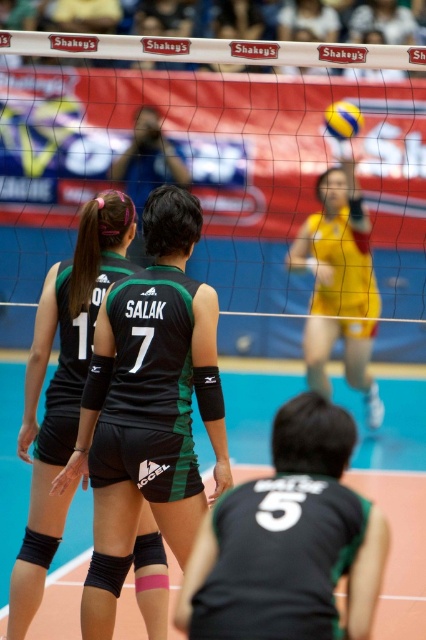
Question: Does transparent nylon net at center appear on the right side of yellow/yellowish-green jersey at center?

Choices:
 (A) yes
 (B) no

Answer: (B)

Question: Does transparent nylon net at center have a smaller size compared to black matte uniform at center?

Choices:
 (A) yes
 (B) no

Answer: (B)

Question: Is black matte uniform at center above yellow/yellowish-green jersey at center?

Choices:
 (A) no
 (B) yes

Answer: (A)

Question: Which point is farther to the camera?

Choices:
 (A) black matte uniform at center
 (B) yellow/yellowish-green jersey at center
 (C) black mesh volleyball net at center

Answer: (C)

Question: Among these objects, which one is farthest from the camera?

Choices:
 (A) black mesh volleyball net at center
 (B) yellow matte volleyball at upper center
 (C) yellow/yellowish-green jersey at center
 (D) black matte uniform at center

Answer: (B)

Question: Based on their relative distances, which object is nearer to the transparent nylon net at center?

Choices:
 (A) yellow matte volleyball at upper center
 (B) black mesh volleyball net at center

Answer: (A)